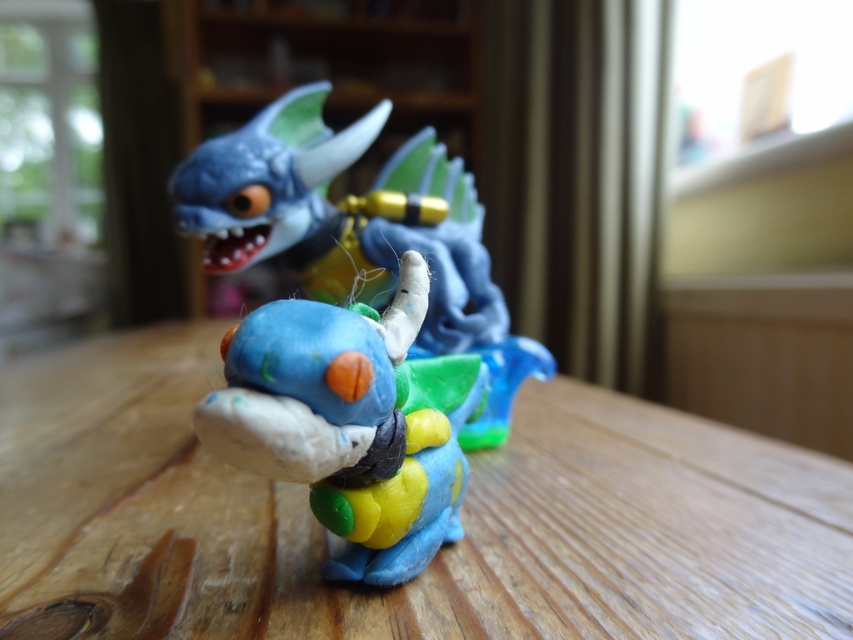
Question: Is the position of wooden table at center more distant than that of matte plastic dragon at center?

Choices:
 (A) no
 (B) yes

Answer: (B)

Question: From the image, what is the correct spatial relationship of wooden table at center in relation to matte plastic toy at center?

Choices:
 (A) right
 (B) left

Answer: (B)

Question: Can you confirm if matte plastic dragon at center is thinner than matte plastic toy at center?

Choices:
 (A) no
 (B) yes

Answer: (B)

Question: Estimate the real-world distances between objects in this image. Which object is farther from the wooden table at center?

Choices:
 (A) matte plastic toy at center
 (B) matte plastic dragon at center

Answer: (A)

Question: Which point appears farthest from the camera in this image?

Choices:
 (A) (523, 618)
 (B) (283, 428)
 (C) (352, 211)

Answer: (C)

Question: Which of these objects is positioned closest to the matte plastic toy at center?

Choices:
 (A) matte plastic dragon at center
 (B) wooden table at center

Answer: (B)